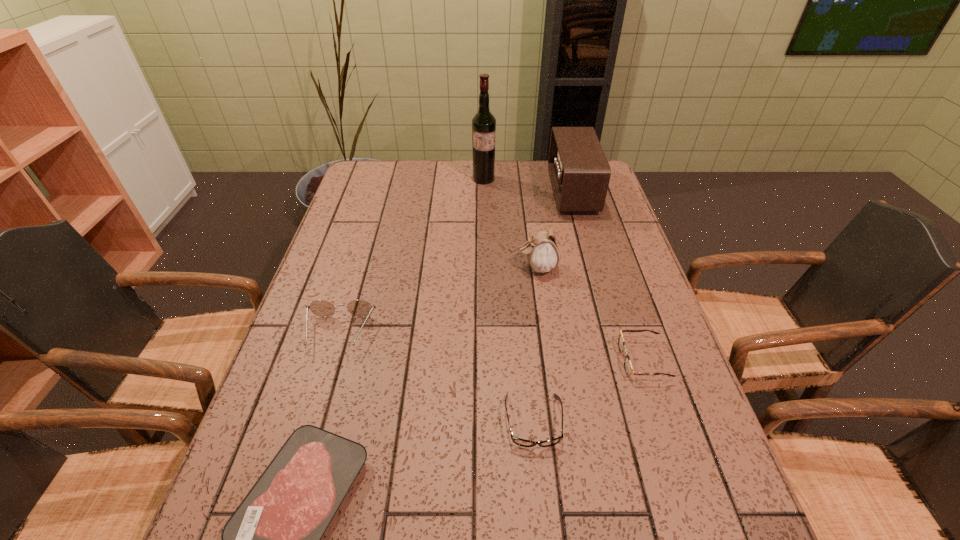
Identify which object is the second closest to the nearest spectacles. Please provide its 2D coordinates. Your answer should be formatted as a tuple, i.e. [(x, y)], where the tuple contains the x and y coordinates of a point satisfying the conditions above.

[(273, 539)]

Identify the location of object that ranks as the second closest to the rightmost spectacles. This screenshot has width=960, height=540. (542, 251).

Identify which spectacles is the nearest to the fourth tallest object. Please provide its 2D coordinates. Your answer should be formatted as a tuple, i.e. [(x, y)], where the tuple contains the x and y coordinates of a point satisfying the conditions above.

[(518, 441)]

Select which spectacles is the third closest to the steak. Please provide its 2D coordinates. Your answer should be formatted as a tuple, i.e. [(x, y)], where the tuple contains the x and y coordinates of a point satisfying the conditions above.

[(628, 367)]

What are the coordinates of `free spot that satisfies the following two spatial constraints: 1. on the front-facing side of the radio receiver; 2. on the front-facing side of the leftmost spectacles` in the screenshot? It's located at (612, 334).

At what (x,y) coordinates should I click in order to perform the action: click on free location that satisfies the following two spatial constraints: 1. on the front-facing side of the pouch; 2. on the front-facing side of the second spectacles from right to left. Please return your answer as a coordinate pair (x, y). Looking at the image, I should click on (559, 421).

You are a GUI agent. You are given a task and a screenshot of the screen. Output one action in this format:
    pyautogui.click(x=<x>, y=<y>)
    Task: Click on the free space that satisfies the following two spatial constraints: 1. on the frame of the rightmost spectacles; 2. on the front-facing side of the second spectacles from left to right
    This screenshot has height=540, width=960.
    Given the screenshot: What is the action you would take?
    pyautogui.click(x=663, y=421)

The height and width of the screenshot is (540, 960). What are the coordinates of `free space in the image that satisfies the following two spatial constraints: 1. on the front-facing side of the second tallest object; 2. on the front-facing side of the second spectacles from left to right` in the screenshot? It's located at pyautogui.click(x=637, y=421).

Find the location of a particular element. This screenshot has width=960, height=540. vacant space that satisfies the following two spatial constraints: 1. on the frame of the rightmost spectacles; 2. on the front-facing side of the second spectacles from right to left is located at coordinates (663, 421).